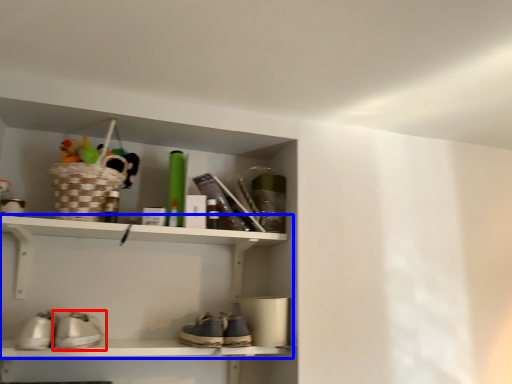
Question: Which object appears farthest to the camera in this image, footwear (highlighted by a red box) or shelf (highlighted by a blue box)?

Choices:
 (A) footwear
 (B) shelf

Answer: (B)